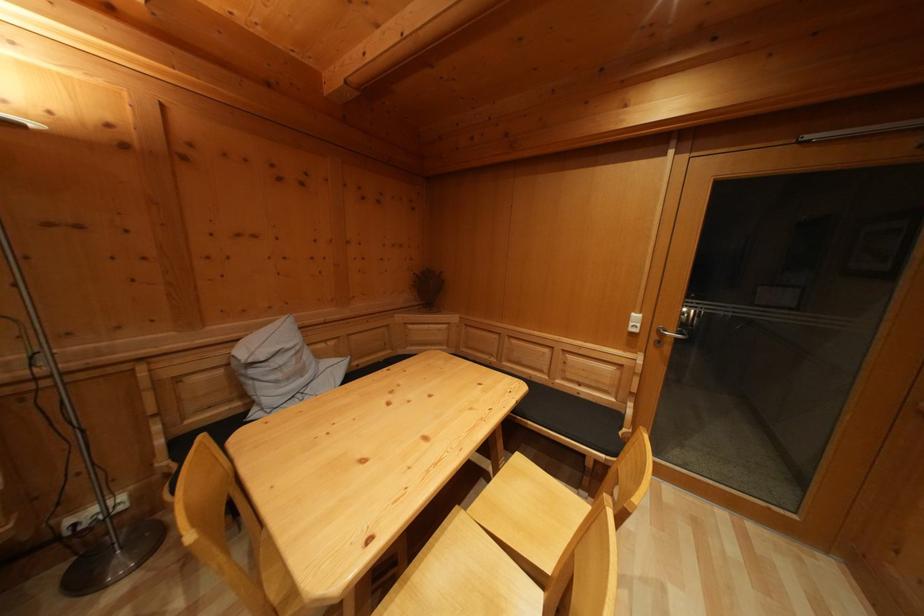
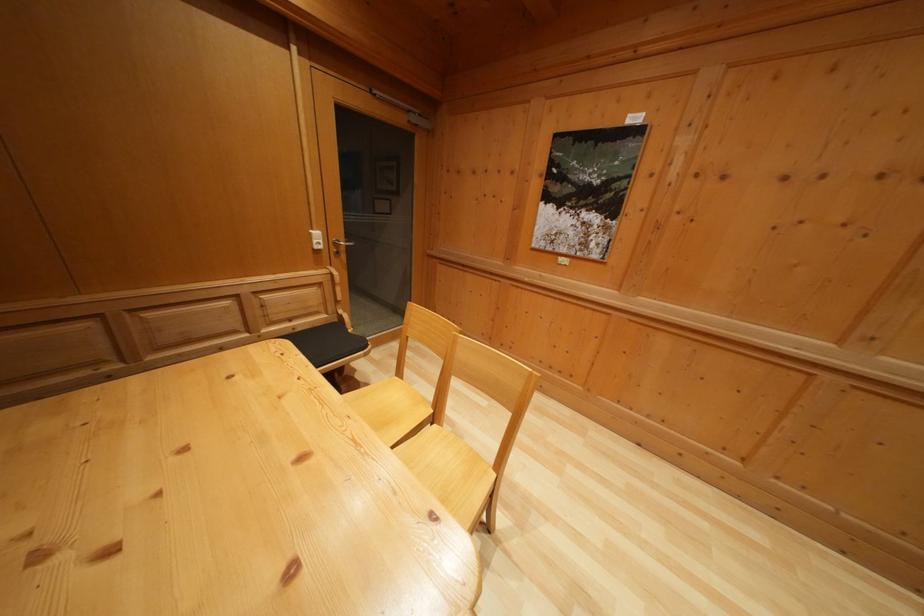
Find the pixel in the second image that matches point (591, 487) in the first image.

(349, 394)